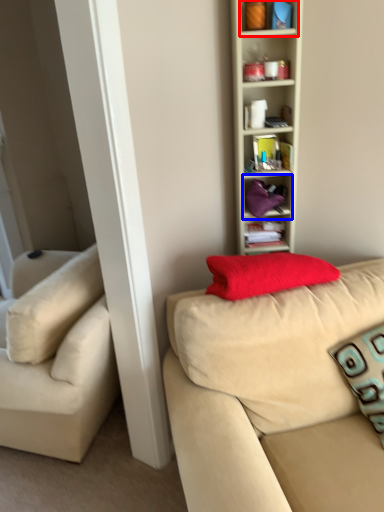
Question: Which point is closer to the camera, cabinet (highlighted by a red box) or cabinet (highlighted by a blue box)?

Choices:
 (A) cabinet
 (B) cabinet

Answer: (A)